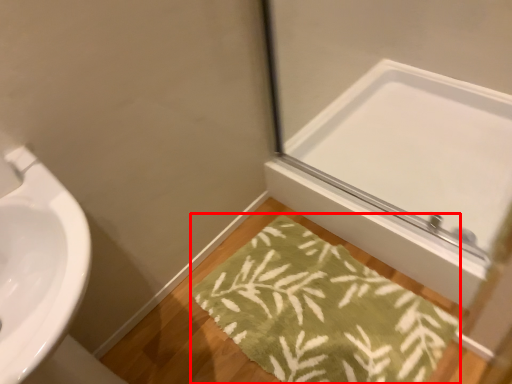
Question: From the image, what is the correct spatial relationship of bath mat (annotated by the red box) in relation to mirror?

Choices:
 (A) left
 (B) right

Answer: (A)